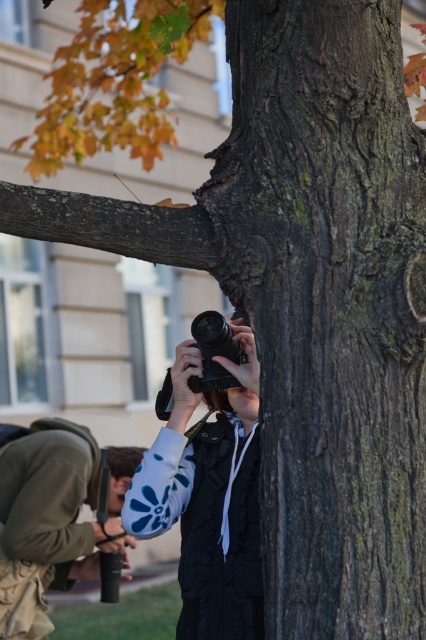
You are a photographer carrying a black matte camera at center and need to hand it to someone standing near the denim jacket at lower left. Can you reach them without moving your feet if your maximum reach is 1.7 meters?

The distance between the black matte camera at center and the denim jacket at lower left is 1.68 meters, which is within your 1.7 meter reach. Yes, you can hand the black matte camera at center to the person near the denim jacket at lower left without moving your feet.

You are a photographer trying to decide whether to use the black matte camera at center or the denim jacket at lower left for a project that requires a taller object. Which one should you choose?

The denim jacket at lower left is taller than the black matte camera at center, so you should choose the denim jacket at lower left for the project requiring a taller object.